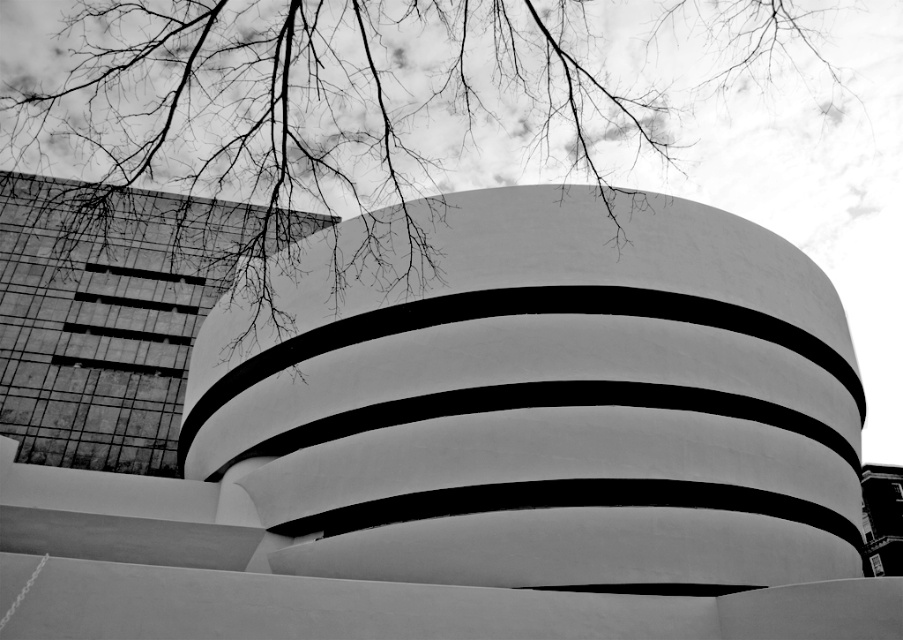
Question: Which point is farther from the camera taking this photo?

Choices:
 (A) (86, 45)
 (B) (649, 483)

Answer: (A)

Question: Which object is closer to the camera taking this photo?

Choices:
 (A) bare branches at upper center
 (B) white smooth building at center

Answer: (B)

Question: From the image, what is the correct spatial relationship of white smooth building at center in relation to bare branches at upper center?

Choices:
 (A) below
 (B) above

Answer: (A)

Question: Is white smooth building at center further to the viewer compared to bare branches at upper center?

Choices:
 (A) yes
 (B) no

Answer: (B)

Question: Which point is closer to the camera?

Choices:
 (A) (784, 22)
 (B) (225, 317)

Answer: (B)

Question: Does white smooth building at center come in front of bare branches at upper center?

Choices:
 (A) yes
 (B) no

Answer: (A)